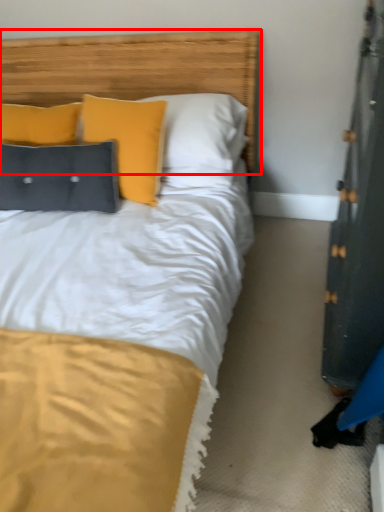
Question: Considering the relative positions of headboard (annotated by the red box) and pillow in the image provided, where is headboard (annotated by the red box) located with respect to the staircase?

Choices:
 (A) left
 (B) right

Answer: (B)